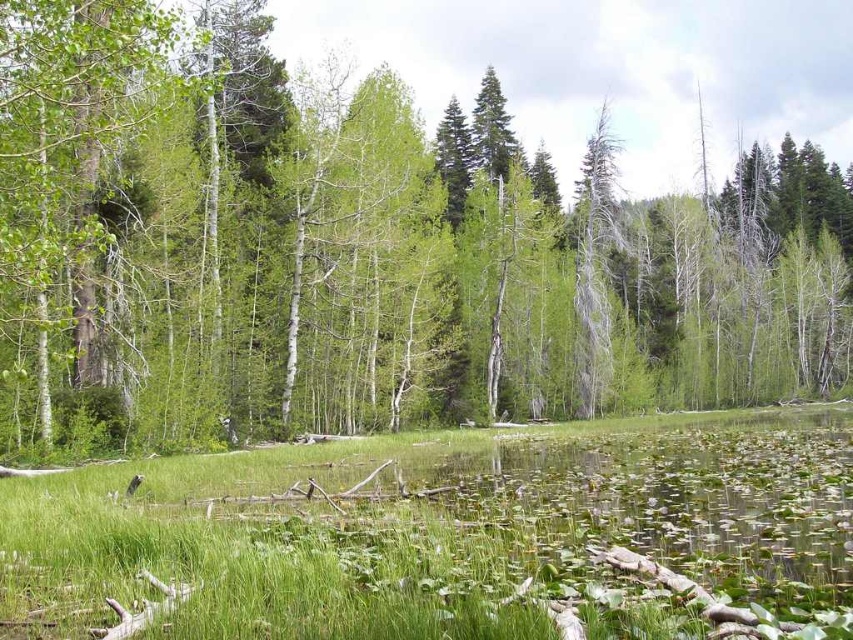
Question: Which point appears farthest from the camera in this image?

Choices:
 (A) (361, 301)
 (B) (384, 572)

Answer: (A)

Question: Does green matte tree at center have a greater width compared to green grass at center?

Choices:
 (A) yes
 (B) no

Answer: (A)

Question: Is green matte tree at center bigger than green grass at center?

Choices:
 (A) yes
 (B) no

Answer: (A)

Question: Is green matte tree at center further to the viewer compared to green grass at center?

Choices:
 (A) no
 (B) yes

Answer: (B)

Question: Which object appears closest to the camera in this image?

Choices:
 (A) green grass at center
 (B) green matte tree at center

Answer: (A)